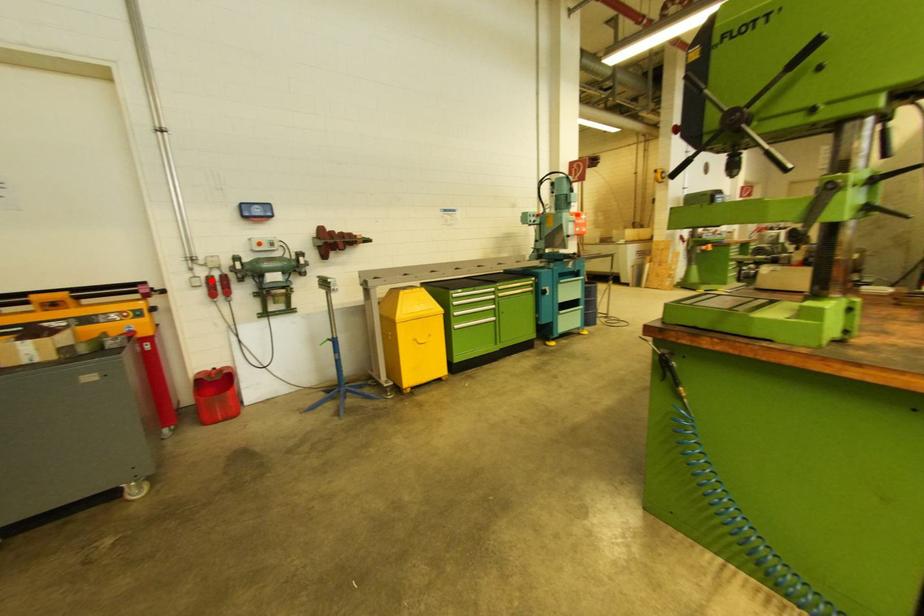
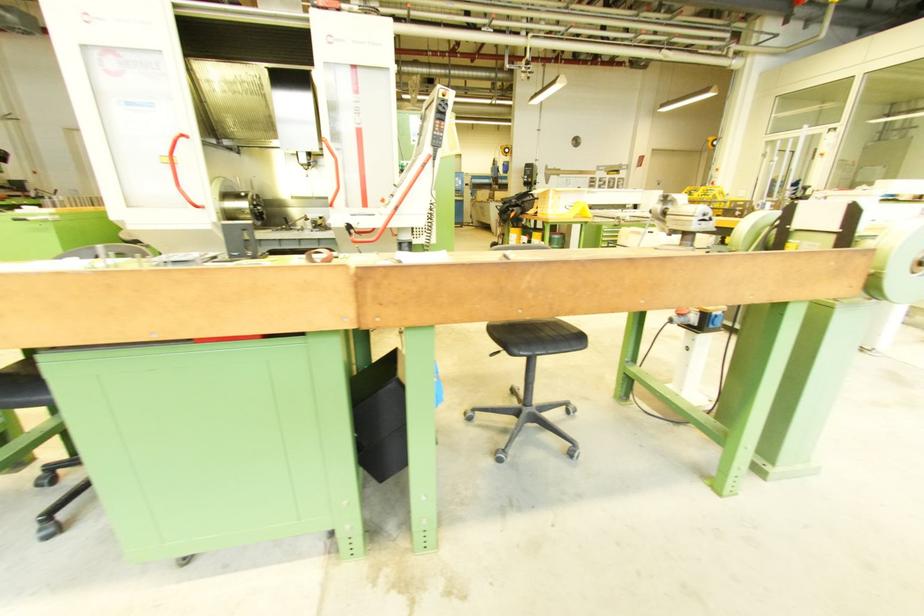
Question: I am providing you with two images of the same scene from different viewpoints. A red point is marked on the first image. At the location where the point appears in image 1, is it still visible in image 2?

Choices:
 (A) Yes
 (B) No

Answer: (B)